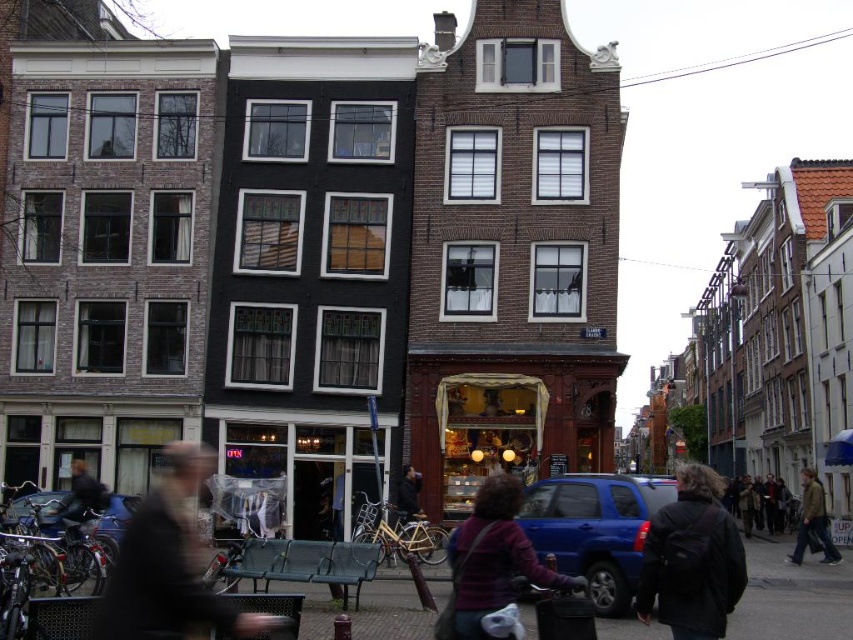
Question: Which object is the closest to the blue metallic bicycle at lower left?

Choices:
 (A) brown leather jacket at lower right
 (B) dark brown leather jacket at center

Answer: (B)

Question: Does blue matte suv at center appear on the left side of blue metallic bicycle at lower left?

Choices:
 (A) no
 (B) yes

Answer: (A)

Question: Which point is farther to the camera?

Choices:
 (A) (408, 484)
 (B) (804, 531)
 (C) (610, 604)
 (D) (573, 579)

Answer: (B)

Question: Which object is the closest to the black leather backpack at lower right?

Choices:
 (A) blue metallic bicycle at lower left
 (B) blurred plastic bag at center
 (C) dark blue jacket at lower left
 (D) brown leather jacket at lower right

Answer: (B)

Question: Does dark blue jacket at lower left have a lesser width compared to dark brown leather jacket at center?

Choices:
 (A) yes
 (B) no

Answer: (B)

Question: In this image, where is blue metallic bicycle at lower left located relative to brown leather jacket at lower right?

Choices:
 (A) above
 (B) below

Answer: (A)